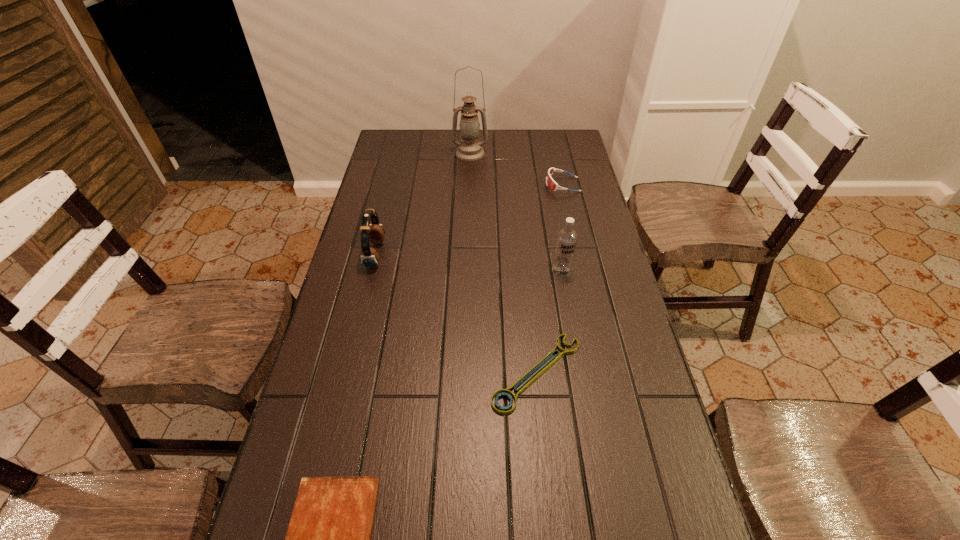
Find the location of a particular element. Image resolution: width=960 pixels, height=540 pixels. the closest object to the fifth nearest object is located at coordinates (469, 149).

In order to click on object that ranks as the fifth closest to the fifth farthest object in this screenshot , I will do `click(469, 149)`.

Locate an element on the screen. free space that satisfies the following two spatial constraints: 1. on the ear cup of the second nearest object; 2. on the left side of the headset is located at coordinates (347, 373).

Where is `vacant space that satisfies the following two spatial constraints: 1. on the front side of the farthest object; 2. on the ear cup of the fourth shortest object`? vacant space that satisfies the following two spatial constraints: 1. on the front side of the farthest object; 2. on the ear cup of the fourth shortest object is located at coordinates (468, 255).